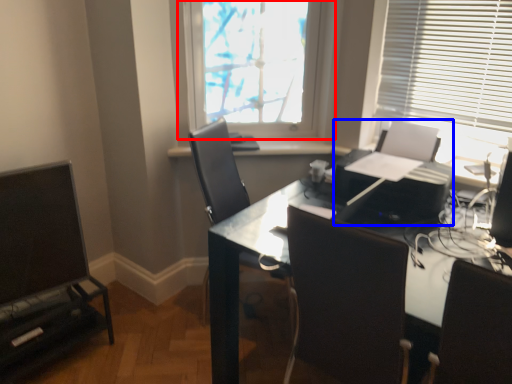
Question: Which point is closer to the camera, window (highlighted by a red box) or printer (highlighted by a blue box)?

Choices:
 (A) window
 (B) printer

Answer: (B)